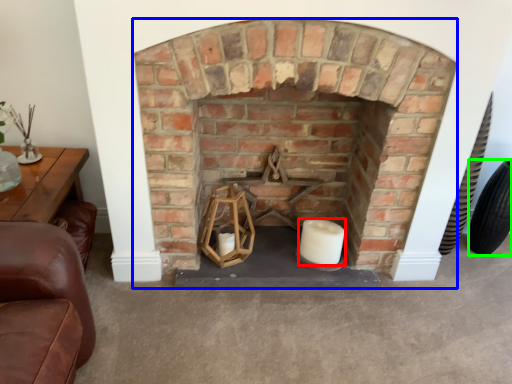
Question: Considering the real-world distances, which object is farthest from candle (highlighted by a red box)? fireplace (highlighted by a blue box) or tire (highlighted by a green box)?

Choices:
 (A) fireplace
 (B) tire

Answer: (B)